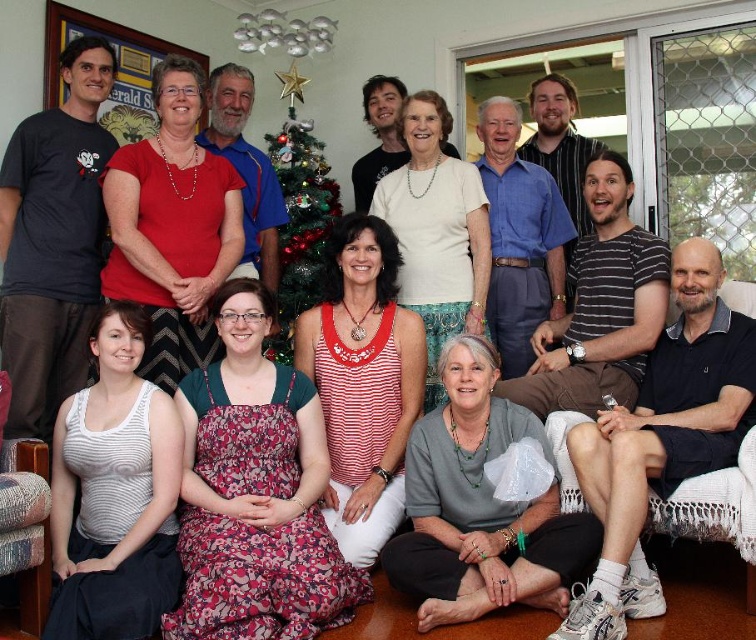
Question: Considering the relative positions of matte black t-shirt at left and decorated christmas tree at center in the image provided, where is matte black t-shirt at left located with respect to decorated christmas tree at center?

Choices:
 (A) left
 (B) right

Answer: (A)

Question: Is the position of matte black t-shirt at left more distant than that of decorated christmas tree at center?

Choices:
 (A) no
 (B) yes

Answer: (A)

Question: Which object is closer to the camera taking this photo?

Choices:
 (A) matte black t-shirt at left
 (B) decorated christmas tree at center

Answer: (A)

Question: Is matte black t-shirt at left to the left of decorated christmas tree at center from the viewer's perspective?

Choices:
 (A) yes
 (B) no

Answer: (A)

Question: Which object appears closest to the camera in this image?

Choices:
 (A) decorated christmas tree at center
 (B) matte black t-shirt at left

Answer: (B)

Question: Which point is closer to the camera?

Choices:
 (A) (299, 124)
 (B) (73, 150)

Answer: (B)